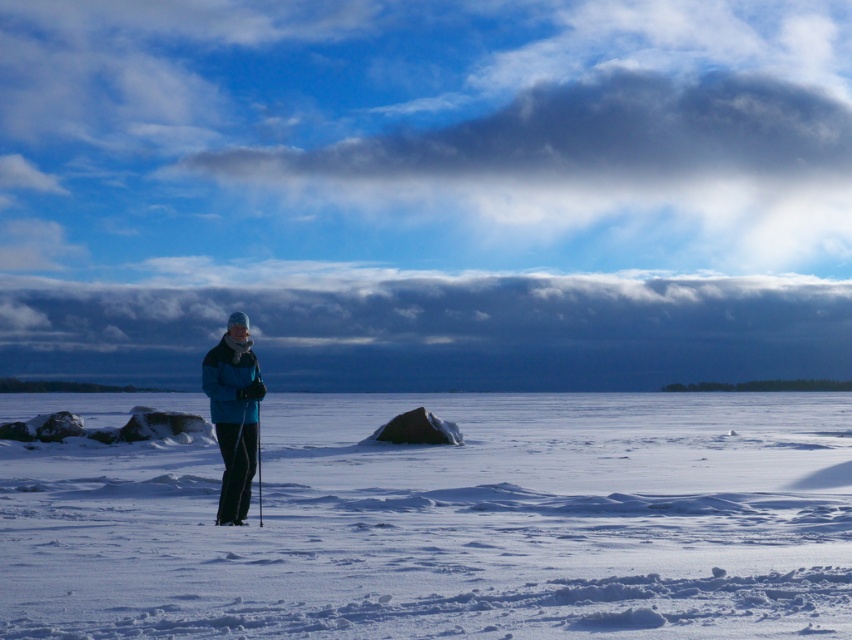
Is point (824, 502) closer to viewer compared to point (246, 385)?

No, (824, 502) is further to viewer.

Locate an element on the screen. This screenshot has height=640, width=852. white powdery snow at center is located at coordinates (447, 524).

Measure the distance between point (193, 592) and camera.

Point (193, 592) is 11.54 meters away from camera.

Image resolution: width=852 pixels, height=640 pixels. Identify the location of white powdery snow at center. (447, 524).